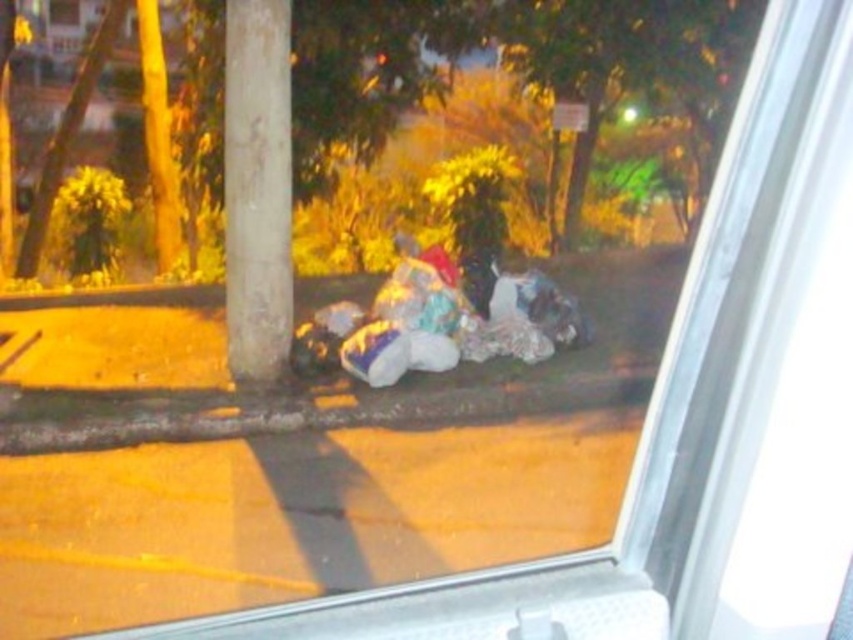
You are standing outside a window and see the green leafy tree at center and the white textured pole at center. Which object is located to the right of the other?

The green leafy tree at center is positioned on the right side of white textured pole at center.

You are a delivery person trying to navigate through the area shown in the image. You need to pass between the white textured pole at center and the fuzzy fabric pile at center. Can you fit through the space between them if your delivery cart is 1.2 meters wide?

The white textured pole at center has a lesser width compared to fuzzy fabric pile at center. However, the exact distance between them isn not specified in the provided information. Without knowing the actual spacing between the two objects, it is impossible to determine if the 1.2 meter wide delivery cart can fit through the space.

You are a delivery person with a cart that is 1.2 meters wide. You need to navigate through the space between the white textured pole at center and the fuzzy fabric pile at center. Can your cart fit through the gap between them?

The distance between the white textured pole at center and the fuzzy fabric pile at center is 1.13 meters. Since your cart is 1.2 meters wide, it cannot fit through the gap as the space is narrower than the cart.